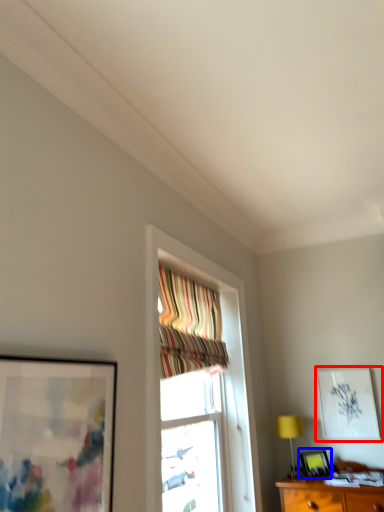
Question: Which object appears closest to the camera in this image, picture frame (highlighted by a red box) or picture frame (highlighted by a blue box)?

Choices:
 (A) picture frame
 (B) picture frame

Answer: (B)